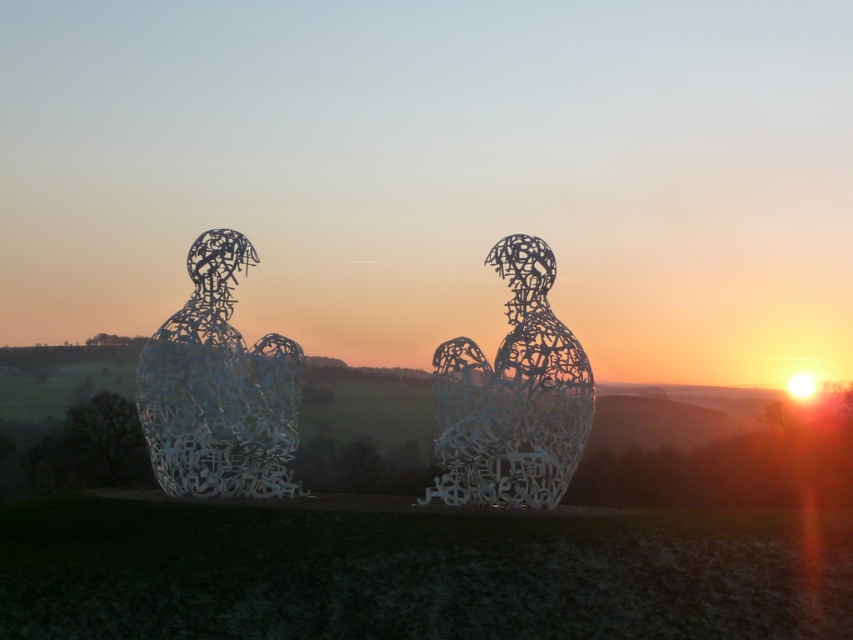
From the picture: Can you confirm if white wire sculpture at left is bigger than metallic wire sculpture at center?

Correct, white wire sculpture at left is larger in size than metallic wire sculpture at center.

Consider the image. Does white wire sculpture at left lie behind metallic wire sculpture at center?

Yes, white wire sculpture at left is behind metallic wire sculpture at center.

Describe the element at coordinates (218, 388) in the screenshot. The height and width of the screenshot is (640, 853). I see `white wire sculpture at left` at that location.

Locate an element on the screen. The width and height of the screenshot is (853, 640). white wire sculpture at left is located at coordinates (218, 388).